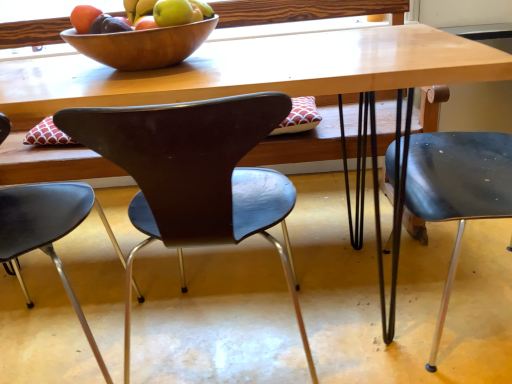
Question: Is matte brown chair at center, the 2th chair in the right-to-left sequence, not within matte black chair at right, the 3th chair from the left?

Choices:
 (A) yes
 (B) no

Answer: (A)

Question: Is matte brown chair at center, the 2th chair in the right-to-left sequence, positioned far away from matte black chair at right, the 3th chair from the left?

Choices:
 (A) yes
 (B) no

Answer: (B)

Question: Does matte brown chair at center, the 2th chair in the right-to-left sequence, appear on the right side of matte black chair at right, acting as the 1th chair starting from the right?

Choices:
 (A) yes
 (B) no

Answer: (B)

Question: Would you say matte brown chair at center, the 2th chair in the right-to-left sequence, contains matte black chair at right, the 3th chair from the left?

Choices:
 (A) no
 (B) yes

Answer: (A)

Question: Does matte brown chair at center, marked as the 2th chair in a left-to-right arrangement, have a larger size compared to matte black chair at right, acting as the 1th chair starting from the right?

Choices:
 (A) no
 (B) yes

Answer: (A)

Question: From the image's perspective, is matte brown chair at center, marked as the 2th chair in a left-to-right arrangement, above or below matte black chair at right, the 3th chair from the left?

Choices:
 (A) above
 (B) below

Answer: (B)

Question: Considering the positions of matte brown chair at center, marked as the 2th chair in a left-to-right arrangement, and matte black chair at right, the 3th chair from the left, in the image, is matte brown chair at center, marked as the 2th chair in a left-to-right arrangement, wider or thinner than matte black chair at right, the 3th chair from the left,?

Choices:
 (A) thin
 (B) wide

Answer: (A)

Question: From their relative heights in the image, would you say matte brown chair at center, the 2th chair in the right-to-left sequence, is taller or shorter than matte black chair at right, the 3th chair from the left?

Choices:
 (A) short
 (B) tall

Answer: (A)

Question: Would you say matte brown chair at center, marked as the 2th chair in a left-to-right arrangement, is to the left or to the right of matte black chair at right, acting as the 1th chair starting from the right, in the picture?

Choices:
 (A) left
 (B) right

Answer: (A)

Question: Looking at their shapes, would you say wooden bowl at upper center is wider or thinner than matte brown chair at center, marked as the 2th chair in a left-to-right arrangement?

Choices:
 (A) wide
 (B) thin

Answer: (B)

Question: Considering the relative positions of wooden bowl at upper center and matte brown chair at center, marked as the 2th chair in a left-to-right arrangement, in the image provided, is wooden bowl at upper center to the left or to the right of matte brown chair at center, marked as the 2th chair in a left-to-right arrangement,?

Choices:
 (A) left
 (B) right

Answer: (A)

Question: Is wooden bowl at upper center inside or outside of matte brown chair at center, marked as the 2th chair in a left-to-right arrangement?

Choices:
 (A) inside
 (B) outside

Answer: (B)

Question: Is point (167, 54) positioned closer to the camera than point (196, 198)?

Choices:
 (A) farther
 (B) closer

Answer: (A)

Question: From a real-world perspective, is matte brown chair at center, marked as the 2th chair in a left-to-right arrangement, above or below wooden bowl at upper center?

Choices:
 (A) above
 (B) below

Answer: (B)

Question: Looking at the image, does matte brown chair at center, marked as the 2th chair in a left-to-right arrangement, seem bigger or smaller compared to wooden bowl at upper center?

Choices:
 (A) small
 (B) big

Answer: (B)